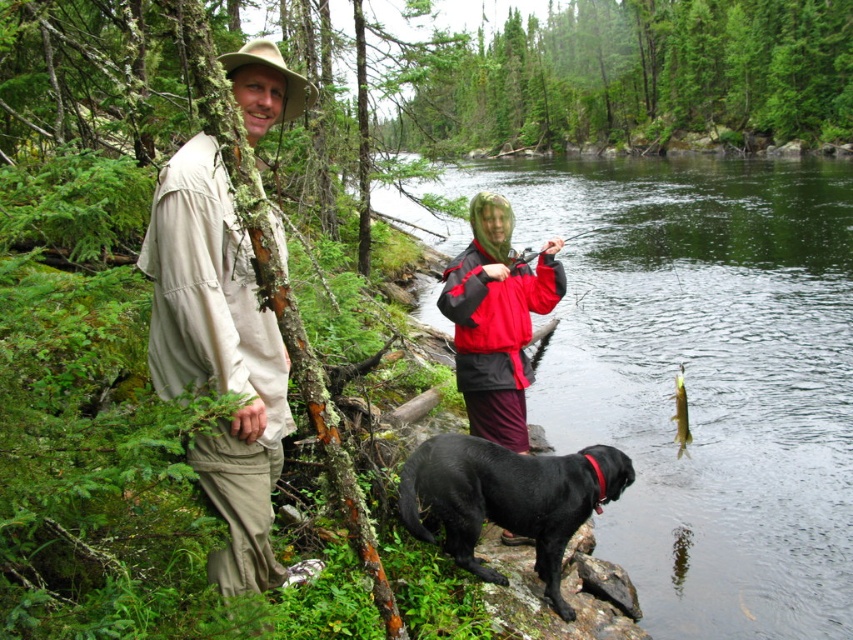
Which is behind, point (682, 472) or point (556, 497)?

Positioned behind is point (682, 472).

Where is `greenish water at upper center`? Image resolution: width=853 pixels, height=640 pixels. greenish water at upper center is located at coordinates [704, 376].

Can you confirm if greenish water at upper center is positioned below shiny gold fish at right?

No, greenish water at upper center is not below shiny gold fish at right.

Between point (743, 436) and point (686, 403), which one is positioned behind?

Positioned behind is point (743, 436).

The image size is (853, 640). I want to click on greenish water at upper center, so click(704, 376).

Is greenish water at upper center taller than red/black jacket at center?

Yes.

Based on the photo, does greenish water at upper center have a lesser width compared to red/black jacket at center?

No, greenish water at upper center is not thinner than red/black jacket at center.

Between point (717, 364) and point (486, 236), which one is positioned in front?

Point (486, 236)

Find the location of a particular element. The image size is (853, 640). greenish water at upper center is located at coordinates (704, 376).